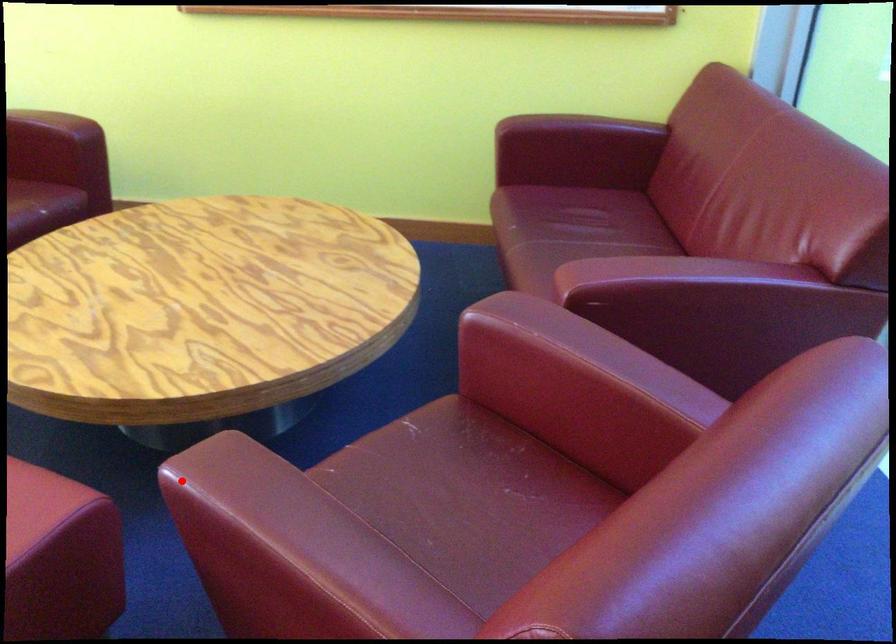
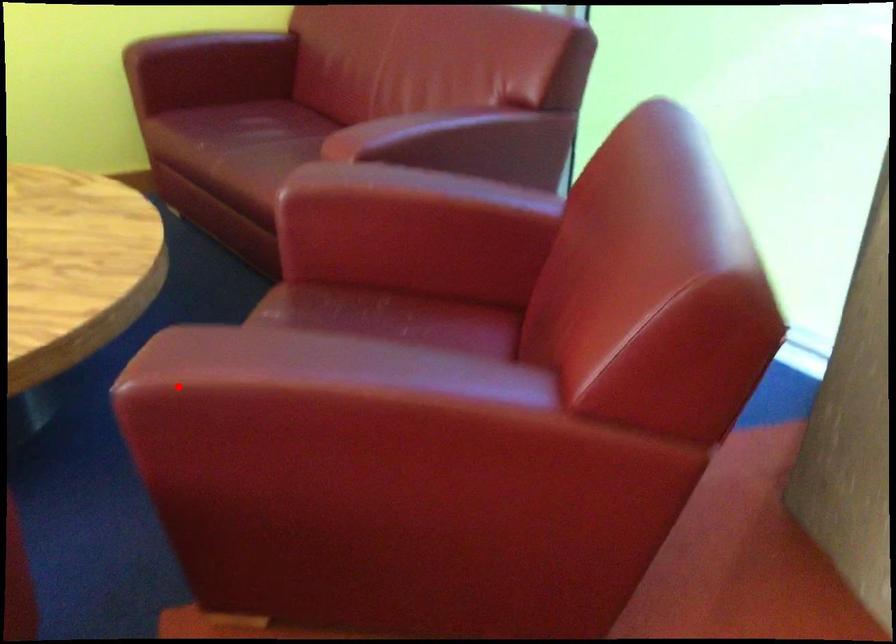
I am providing you with two images of the same scene from different viewpoints. A red point is marked on the first image and another point is marked on the second image. Is the red point in image1 aligned with the point shown in image2?

Yes